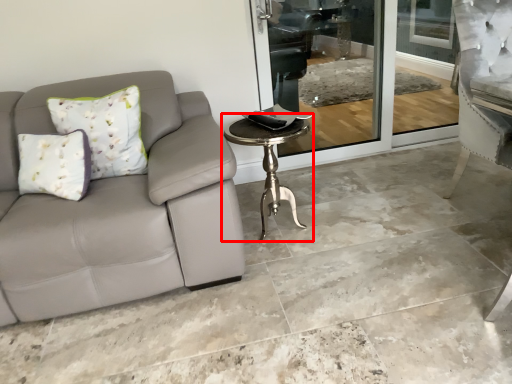
Question: From the image's perspective, what is the correct spatial positioning of table (annotated by the red box) in reference to concrete?

Choices:
 (A) above
 (B) below

Answer: (B)